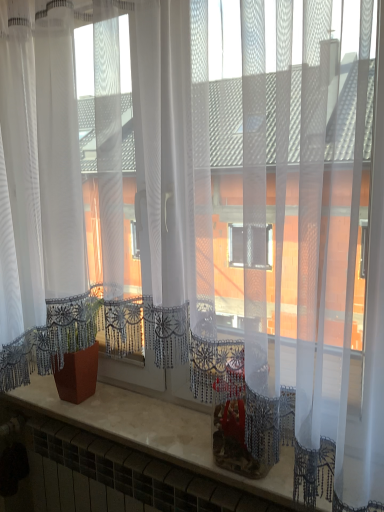
What do you see at coordinates (73, 345) in the screenshot? The image size is (384, 512). I see `matte terracotta pot at lower left` at bounding box center [73, 345].

The height and width of the screenshot is (512, 384). Find the location of `matte terracotta pot at lower left`. matte terracotta pot at lower left is located at coordinates (73, 345).

What is the approximate height of matte terracotta pot at lower left?

11.80 inches.

Measure the distance between point (48, 314) and camera.

Point (48, 314) and camera are 4.04 feet apart from each other.

This screenshot has width=384, height=512. What do you see at coordinates (154, 430) in the screenshot? I see `marble counter top at center` at bounding box center [154, 430].

In order to face marble counter top at center, should I rotate leftwards or rightwards?

To align with it, rotate left about 7.222°.

Identify the location of marble counter top at center. (154, 430).

What is the approximate width of marble counter top at center?

The width of marble counter top at center is 9.38 inches.

Locate an element on the screen. Image resolution: width=384 pixels, height=512 pixels. matte terracotta pot at lower left is located at coordinates tap(73, 345).

Is marble counter top at center at the left side of matte terracotta pot at lower left?

Incorrect, marble counter top at center is not on the left side of matte terracotta pot at lower left.

Is marble counter top at center in front of or behind matte terracotta pot at lower left in the image?

Clearly, marble counter top at center is in front of matte terracotta pot at lower left.

Does point (157, 429) lie behind point (57, 360)?

Yes, it is.

From the image's perspective, does marble counter top at center appear lower than matte terracotta pot at lower left?

Correct, marble counter top at center appears lower than matte terracotta pot at lower left in the image.

From a real-world perspective, is marble counter top at center positioned above or below matte terracotta pot at lower left?

marble counter top at center is below matte terracotta pot at lower left.

Is marble counter top at center wider than matte terracotta pot at lower left?

Indeed, marble counter top at center has a greater width compared to matte terracotta pot at lower left.

Considering the sizes of marble counter top at center and matte terracotta pot at lower left in the image, is marble counter top at center taller or shorter than matte terracotta pot at lower left?

Considering their sizes, marble counter top at center has less height than matte terracotta pot at lower left.

Who is bigger, marble counter top at center or matte terracotta pot at lower left?

With larger size is marble counter top at center.

Is marble counter top at center inside or outside of matte terracotta pot at lower left?

marble counter top at center cannot be found inside matte terracotta pot at lower left.

Is there a large distance between marble counter top at center and matte terracotta pot at lower left?

They are positioned close to each other.

Is marble counter top at center facing towards matte terracotta pot at lower left?

No, marble counter top at center is not turned towards matte terracotta pot at lower left.

Looking at this image, how many degrees apart are the facing directions of marble counter top at center and matte terracotta pot at lower left?

The facing directions of marble counter top at center and matte terracotta pot at lower left are 1.2 degrees apart.

I want to click on counter top below the matte terracotta pot at lower left (from a real-world perspective), so click(x=154, y=430).

Is matte terracotta pot at lower left at the right side of marble counter top at center?

Incorrect, matte terracotta pot at lower left is not on the right side of marble counter top at center.

Is matte terracotta pot at lower left further to camera compared to marble counter top at center?

Yes, the depth of matte terracotta pot at lower left is greater than that of marble counter top at center.

Is point (74, 327) closer to camera compared to point (217, 473)?

No, it is not.

From the image's perspective, relative to marble counter top at center, is matte terracotta pot at lower left above or below?

From the image's perspective, matte terracotta pot at lower left appears above marble counter top at center.

From a real-world perspective, which is physically below, matte terracotta pot at lower left or marble counter top at center?

marble counter top at center.

Which of these two, matte terracotta pot at lower left or marble counter top at center, is thinner?

matte terracotta pot at lower left is thinner.

From their relative heights in the image, would you say matte terracotta pot at lower left is taller or shorter than marble counter top at center?

Clearly, matte terracotta pot at lower left is taller compared to marble counter top at center.

Is matte terracotta pot at lower left smaller than marble counter top at center?

Yes.

Is matte terracotta pot at lower left surrounding marble counter top at center?

No, marble counter top at center is not a part of matte terracotta pot at lower left.

Would you say matte terracotta pot at lower left is a long distance from marble counter top at center?

They are positioned close to each other.

Is matte terracotta pot at lower left oriented towards marble counter top at center?

No, matte terracotta pot at lower left is not aimed at marble counter top at center.

From the picture: Can you tell me how much matte terracotta pot at lower left and marble counter top at center differ in facing direction?

1.2 degrees.

The width and height of the screenshot is (384, 512). Find the location of `counter top below the matte terracotta pot at lower left (from a real-world perspective)`. counter top below the matte terracotta pot at lower left (from a real-world perspective) is located at coordinates (154, 430).

This screenshot has width=384, height=512. In order to click on houseplant behind the marble counter top at center in this screenshot , I will do `click(73, 345)`.

I want to click on houseplant located above the marble counter top at center (from a real-world perspective), so click(73, 345).